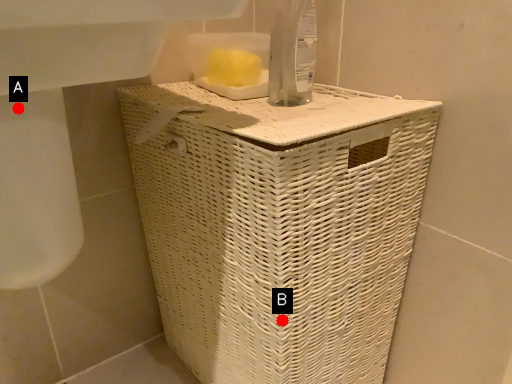
Question: Two points are circled on the image, labeled by A and B beside each circle. Among these points, which one is farthest from the camera?

Choices:
 (A) A is further
 (B) B is further

Answer: (B)